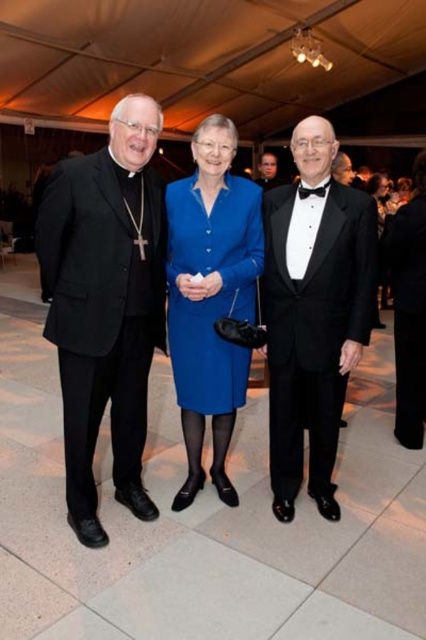
You are a photographer setting up for a group photo. You need to ensure that the matte blue dress at center and the black satin tuxedo at right are both fully visible in the frame. Based on their widths, which one might require more space horizontally?

The matte blue dress at center might be wider than the black satin tuxedo at right, so it might require more horizontal space to ensure it is fully visible in the frame.

You are a photographer setting up for a group photo. You need to arrange the subjects so that the matte blue dress at center and the black satin tuxedo at right are visible in the frame. Given their heights, which subject should you position closer to the camera to ensure both are fully visible?

The matte blue dress at center is much taller than the black satin tuxedo at right. To ensure both are fully visible, position the black satin tuxedo at right closer to the camera so that the taller matte blue dress at center can be seen behind without being cut off.

You are a photographer at the event and need to adjust the lighting between the black matte suit at left and the smooth black suit at center. Can you fit a 3.5 meter long lighting strip between them?

The distance between the black matte suit at left and the smooth black suit at center is 3.34 meters. The 3.5 meter lighting strip is longer than the space available, so it won not fit.